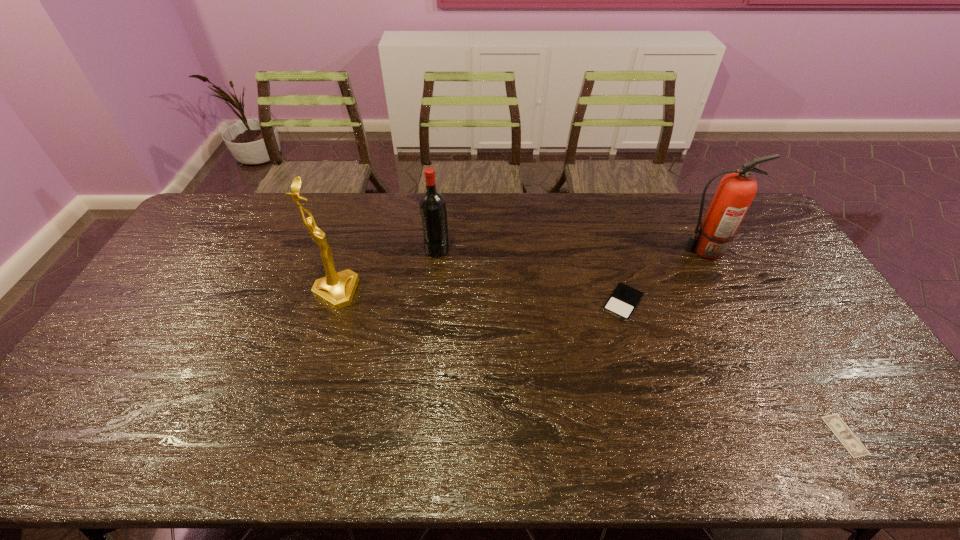
At what (x,y) coordinates should I click in order to perform the action: click on the leftmost object. Please return your answer as a coordinate pair (x, y). The image size is (960, 540). Looking at the image, I should click on (336, 289).

Identify the location of fire extinguisher. (736, 191).

Where is `wine bottle`? wine bottle is located at coordinates (432, 204).

Locate an element on the screen. the fourth object from right to left is located at coordinates coord(432,204).

In order to click on the third object from right to left in this screenshot , I will do `click(623, 301)`.

Where is `the fourth tallest object`? the fourth tallest object is located at coordinates (623, 301).

Identify the location of money. This screenshot has width=960, height=540. (847, 438).

At what (x,y) coordinates should I click in order to perform the action: click on the nearest object. Please return your answer as a coordinate pair (x, y). This screenshot has height=540, width=960. Looking at the image, I should click on (847, 438).

Where is `vacant area located 0.300m on the front-facing side of the leftmost object`? Image resolution: width=960 pixels, height=540 pixels. vacant area located 0.300m on the front-facing side of the leftmost object is located at coordinates (454, 292).

The image size is (960, 540). I want to click on free location located on the nozzle of the fire extinguisher, so click(x=642, y=251).